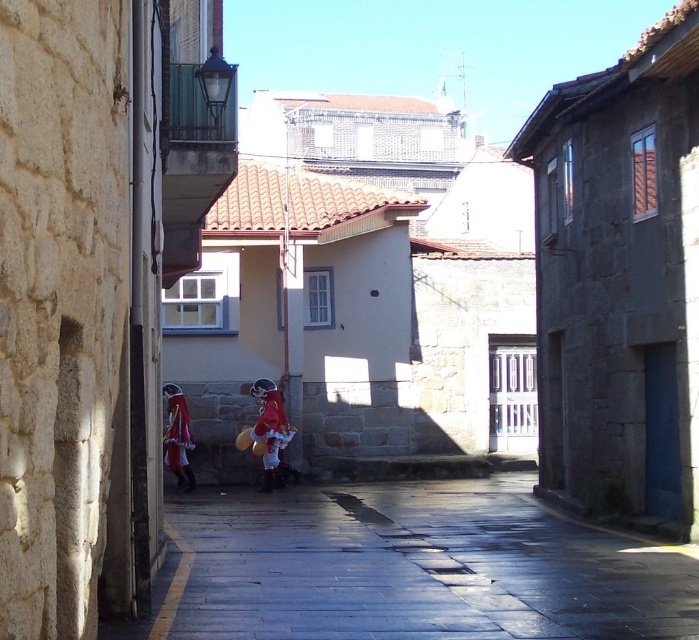
Question: Which point is closer to the camera?

Choices:
 (A) velvet red cape at center
 (B) smooth stone pavement at center
 (C) red velvet santa claus at center

Answer: (B)

Question: Can you confirm if red velvet santa claus at center is positioned below velvet red cape at center?

Choices:
 (A) yes
 (B) no

Answer: (A)

Question: In this image, where is smooth stone pavement at center located relative to red velvet santa claus at center?

Choices:
 (A) above
 (B) below

Answer: (B)

Question: Which point is farther to the camera?

Choices:
 (A) smooth stone pavement at center
 (B) red velvet santa claus at center

Answer: (B)

Question: Which point is farther to the camera?

Choices:
 (A) (226, 573)
 (B) (264, 433)

Answer: (B)

Question: Is the position of smooth stone pavement at center more distant than that of red velvet santa claus at center?

Choices:
 (A) yes
 (B) no

Answer: (B)